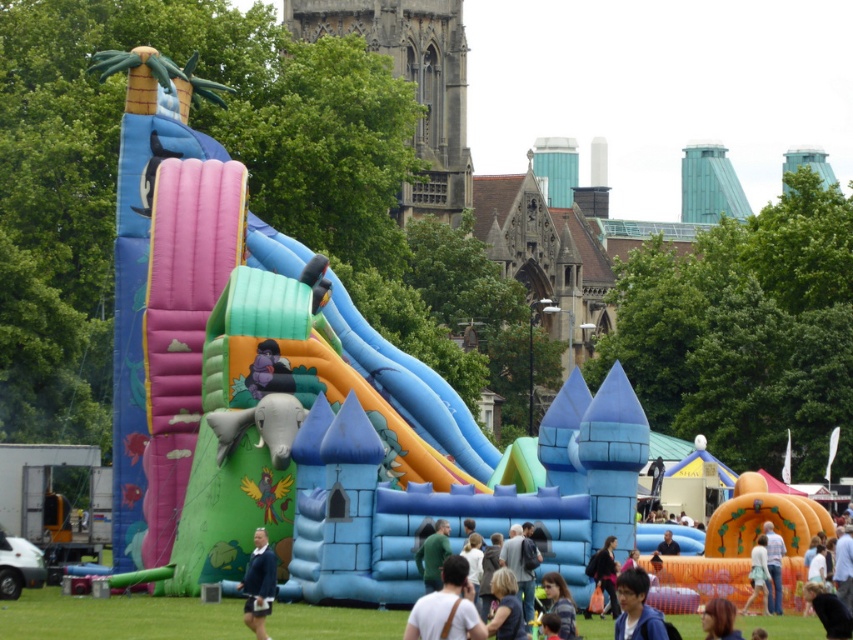
Which is more to the left, light brown leather jacket at center or blue denim jacket at lower center?

light brown leather jacket at center

Is light brown leather jacket at center shorter than blue denim jacket at lower center?

Incorrect, light brown leather jacket at center's height does not fall short of blue denim jacket at lower center's.

Find the location of a particular element. light brown leather jacket at center is located at coordinates (445, 609).

Who is shorter, light blue denim jeans at lower right or light blue denim jacket at lower right?

Standing shorter between the two is light blue denim jeans at lower right.

Which is in front, point (776, 577) or point (759, 541)?

Positioned in front is point (776, 577).

Does point (769, 596) come closer to viewer compared to point (763, 593)?

That is False.

You are a GUI agent. You are given a task and a screenshot of the screen. Output one action in this format:
    pyautogui.click(x=<x>, y=<y>)
    Task: Click on the light blue denim jeans at lower right
    The image size is (853, 640).
    Given the screenshot: What is the action you would take?
    pyautogui.click(x=773, y=566)

Between blonde hair at center and blonde hair at lower right, which one appears on the left side from the viewer's perspective?

blonde hair at center

In the scene shown: Is blonde hair at center bigger than blonde hair at lower right?

Incorrect, blonde hair at center is not larger than blonde hair at lower right.

Does point (502, 632) lie behind point (727, 608)?

Yes.

Identify the location of blonde hair at center. (505, 608).